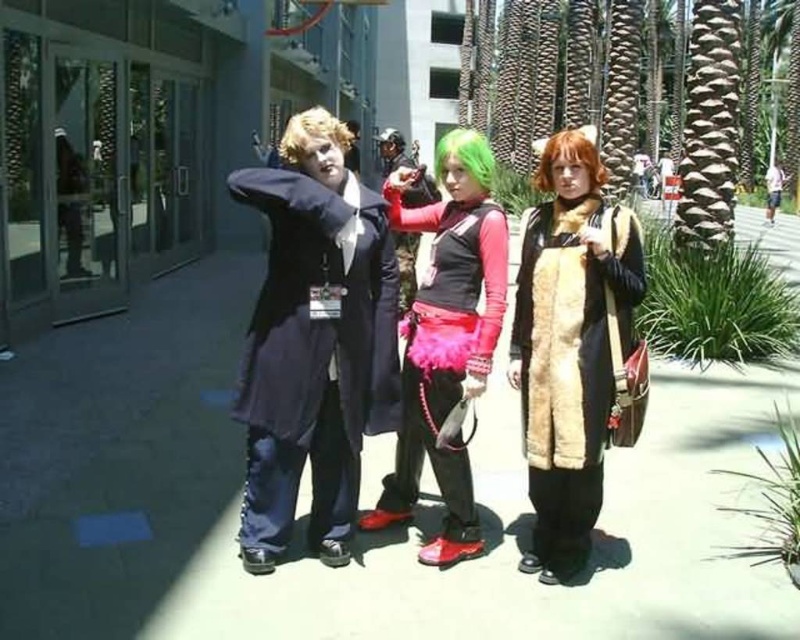
You are a photographer trying to capture the middle individual in the scene. Since the fuzzy brown coat at center and the velvet pink skirt at center are both in the middle, which one should you focus on to ensure the middle individual is clearly visible?

The fuzzy brown coat at center is in front of the velvet pink skirt at center, so focusing on the fuzzy brown coat at center will ensure the middle individual is clearly visible.